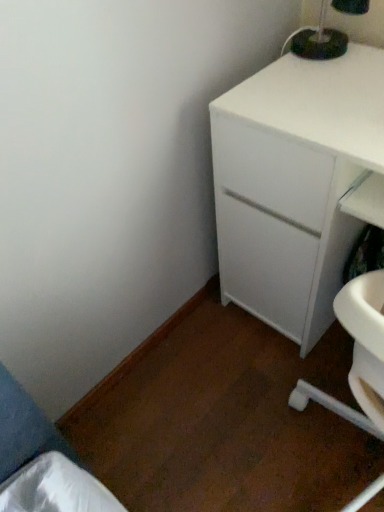
Describe the element at coordinates (318, 40) in the screenshot. I see `black plastic lamp at upper right` at that location.

Find the location of a particular element. black plastic lamp at upper right is located at coordinates (318, 40).

Measure the distance between white matte cabinet at upper right and camera.

white matte cabinet at upper right and camera are 29.81 inches apart from each other.

In order to face white matte cabinet at upper right, should I rotate leftwards or rightwards?

It's best to rotate right around 18.438 degrees.

Locate an element on the screen. The width and height of the screenshot is (384, 512). white matte cabinet at upper right is located at coordinates (297, 184).

The height and width of the screenshot is (512, 384). Describe the element at coordinates (297, 184) in the screenshot. I see `white matte cabinet at upper right` at that location.

Find the location of a particular element. Image resolution: width=384 pixels, height=512 pixels. black plastic lamp at upper right is located at coordinates (318, 40).

Which object is positioned more to the left, white matte cabinet at upper right or black plastic lamp at upper right?

Positioned to the left is black plastic lamp at upper right.

Is the position of white matte cabinet at upper right more distant than that of black plastic lamp at upper right?

That is False.

Does point (222, 180) come behind point (307, 59)?

Yes, point (222, 180) is behind point (307, 59).

From the image's perspective, is white matte cabinet at upper right positioned above or below black plastic lamp at upper right?

From the image's perspective, white matte cabinet at upper right appears below black plastic lamp at upper right.

From a real-world perspective, is white matte cabinet at upper right below black plastic lamp at upper right?

Yes, from a real-world perspective, white matte cabinet at upper right is under black plastic lamp at upper right.

Between white matte cabinet at upper right and black plastic lamp at upper right, which one has larger width?

white matte cabinet at upper right.

Who is taller, white matte cabinet at upper right or black plastic lamp at upper right?

white matte cabinet at upper right.

Between white matte cabinet at upper right and black plastic lamp at upper right, which one has smaller size?

black plastic lamp at upper right is smaller.

Is white matte cabinet at upper right located outside black plastic lamp at upper right?

Yes, white matte cabinet at upper right is not within black plastic lamp at upper right.

Is white matte cabinet at upper right directly adjacent to black plastic lamp at upper right?

No.

Is white matte cabinet at upper right facing towards black plastic lamp at upper right?

No, white matte cabinet at upper right is not turned towards black plastic lamp at upper right.

What's the angular difference between white matte cabinet at upper right and black plastic lamp at upper right's facing directions?

The angular difference between white matte cabinet at upper right and black plastic lamp at upper right is 40.7 degrees.

Measure the distance between white matte cabinet at upper right and black plastic lamp at upper right.

white matte cabinet at upper right and black plastic lamp at upper right are 14.13 inches apart from each other.

In the image, there is a black plastic lamp at upper right. What are the coordinates of `the chest of drawers below it (from a real-world perspective)` in the screenshot? It's located at (297, 184).

Is black plastic lamp at upper right to the left of white matte cabinet at upper right from the viewer's perspective?

Indeed, black plastic lamp at upper right is positioned on the left side of white matte cabinet at upper right.

Considering the positions of objects black plastic lamp at upper right and white matte cabinet at upper right in the image provided, who is behind, black plastic lamp at upper right or white matte cabinet at upper right?

Positioned behind is black plastic lamp at upper right.

Considering the positions of point (321, 18) and point (260, 124), is point (321, 18) closer or farther from the camera than point (260, 124)?

Point (321, 18) appears to be farther away from the viewer than point (260, 124).

From the image's perspective, is black plastic lamp at upper right over white matte cabinet at upper right?

Correct, black plastic lamp at upper right appears higher than white matte cabinet at upper right in the image.

From a real-world perspective, is black plastic lamp at upper right located beneath white matte cabinet at upper right?

No, from a real-world perspective, black plastic lamp at upper right is not below white matte cabinet at upper right.

Considering the sizes of objects black plastic lamp at upper right and white matte cabinet at upper right in the image provided, who is thinner, black plastic lamp at upper right or white matte cabinet at upper right?

black plastic lamp at upper right is thinner.

Considering the relative sizes of black plastic lamp at upper right and white matte cabinet at upper right in the image provided, is black plastic lamp at upper right shorter than white matte cabinet at upper right?

Correct, black plastic lamp at upper right is not as tall as white matte cabinet at upper right.

In terms of size, does black plastic lamp at upper right appear bigger or smaller than white matte cabinet at upper right?

Clearly, black plastic lamp at upper right is smaller in size than white matte cabinet at upper right.

Does black plastic lamp at upper right contain white matte cabinet at upper right?

Actually, white matte cabinet at upper right is outside black plastic lamp at upper right.

Is black plastic lamp at upper right far from white matte cabinet at upper right?

No, black plastic lamp at upper right is in close proximity to white matte cabinet at upper right.

Is white matte cabinet at upper right at the back of black plastic lamp at upper right?

No.

How many degrees apart are the facing directions of black plastic lamp at upper right and white matte cabinet at upper right?

They differ by 40.7 degrees in their facing directions.

I want to click on bedside lamp above the white matte cabinet at upper right (from the image's perspective), so click(x=318, y=40).

What are the coordinates of `bedside lamp behind the white matte cabinet at upper right` in the screenshot? It's located at (318, 40).

Image resolution: width=384 pixels, height=512 pixels. I want to click on bedside lamp on the left of white matte cabinet at upper right, so click(318, 40).